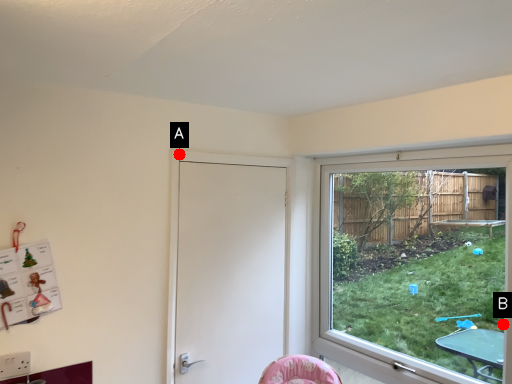
Question: Two points are circled on the image, labeled by A and B beside each circle. Which point is farther from the camera taking this photo?

Choices:
 (A) A is further
 (B) B is further

Answer: (B)